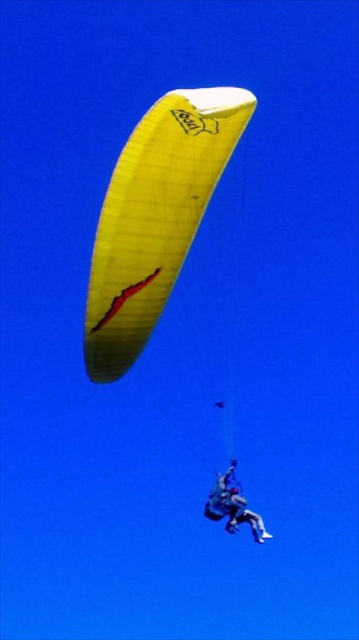
Is yellow mesh parachute at upper center positioned before matte blue jumpsuit at center?

That is True.

Can you confirm if yellow mesh parachute at upper center is positioned to the right of matte blue jumpsuit at center?

Incorrect, yellow mesh parachute at upper center is not on the right side of matte blue jumpsuit at center.

Image resolution: width=359 pixels, height=640 pixels. Identify the location of yellow mesh parachute at upper center. (155, 218).